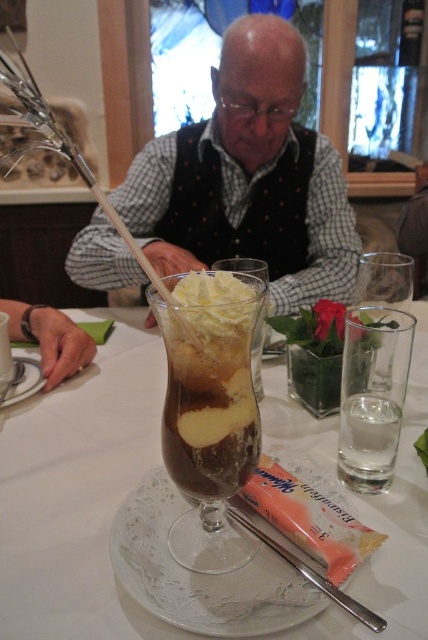
Question: Which is nearer to the chocolate gelatinous dessert at center?

Choices:
 (A) translucent glass dessert at center
 (B) white creamy wafer at center
 (C) white lace plate at center

Answer: (B)

Question: Where is matte black vest at center located in relation to silver metallic chopstick at lower center in the image?

Choices:
 (A) right
 (B) left

Answer: (B)

Question: Can you confirm if translucent glass dessert at center is positioned below white creamy wafer at center?

Choices:
 (A) yes
 (B) no

Answer: (B)

Question: Estimate the real-world distances between objects in this image. Which object is farther from the white porcelain plate at lower left?

Choices:
 (A) white lace plate at center
 (B) translucent glass dessert at center
 (C) silver metallic chopstick at lower center

Answer: (C)

Question: Can you confirm if chocolate gelatinous dessert at center is wider than silver metallic chopstick at lower center?

Choices:
 (A) no
 (B) yes

Answer: (A)

Question: Among these objects, which one is farthest from the camera?

Choices:
 (A) white porcelain plate at lower left
 (B) silver metallic chopstick at lower center

Answer: (A)